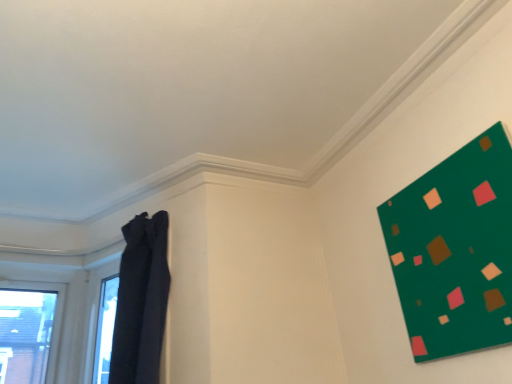
Question: From a real-world perspective, relative to dark fabric curtain at left, is green matte board at upper right vertically above or below?

Choices:
 (A) below
 (B) above

Answer: (A)

Question: Based on their positions, is green matte board at upper right located to the left or right of dark fabric curtain at left?

Choices:
 (A) right
 (B) left

Answer: (A)

Question: From the image's perspective, is green matte board at upper right positioned above or below dark fabric curtain at left?

Choices:
 (A) above
 (B) below

Answer: (A)

Question: Is dark fabric curtain at left taller or shorter than green matte board at upper right?

Choices:
 (A) short
 (B) tall

Answer: (B)

Question: Is dark fabric curtain at left spatially inside green matte board at upper right, or outside of it?

Choices:
 (A) outside
 (B) inside

Answer: (A)

Question: In the image, is dark fabric curtain at left positioned in front of or behind green matte board at upper right?

Choices:
 (A) front
 (B) behind

Answer: (B)

Question: From a real-world perspective, is dark fabric curtain at left above or below green matte board at upper right?

Choices:
 (A) above
 (B) below

Answer: (A)